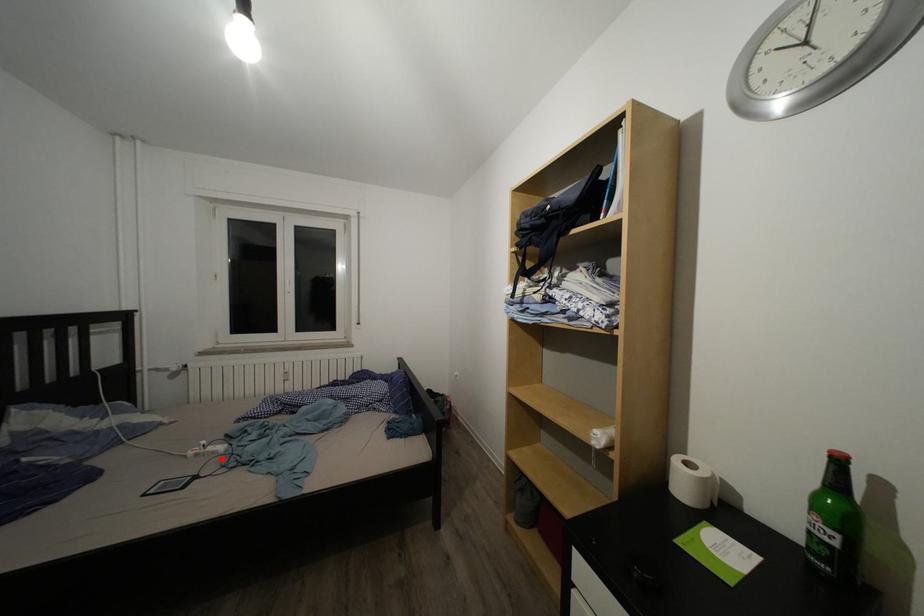
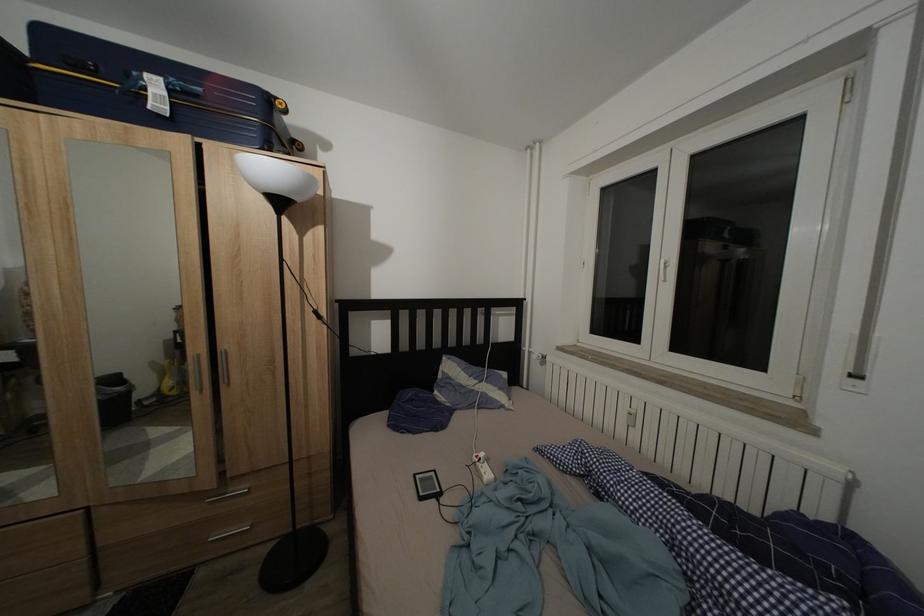
Where in the second image is the point corresponding to the highlighted location from the first image?

(488, 483)